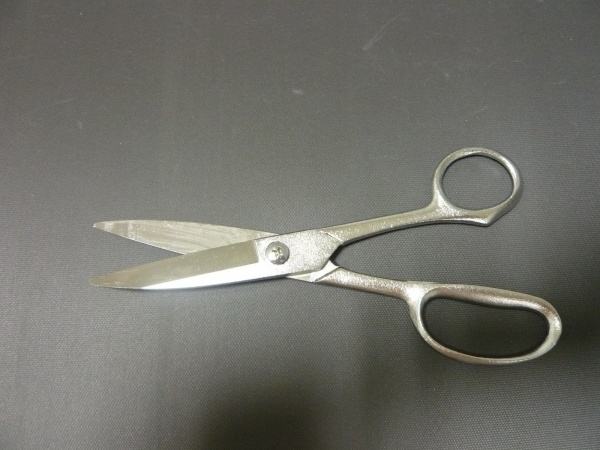
Locate an element on the screen. table is located at coordinates (274, 143).